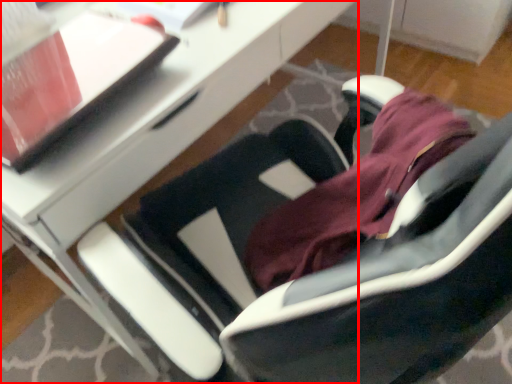
Question: From the image's perspective, what is the correct spatial positioning of desk (annotated by the red box) in reference to notepad?

Choices:
 (A) below
 (B) above

Answer: (B)